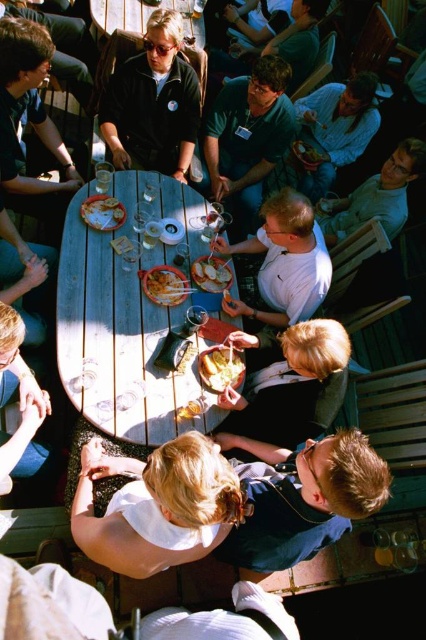
Question: Observing the image, what is the correct spatial positioning of blue denim shirt at lower right in reference to matte black shirt at left?

Choices:
 (A) below
 (B) above

Answer: (A)

Question: Which point is closer to the camera?

Choices:
 (A) white matte shirt at lower center
 (B) white matte shirt at center

Answer: (A)

Question: Which object appears farthest from the camera in this image?

Choices:
 (A) green matte shirt at upper center
 (B) smooth white plate at center

Answer: (A)

Question: Does white matte shirt at lower center come behind green cotton shirt at upper center?

Choices:
 (A) no
 (B) yes

Answer: (A)

Question: Is smooth white plate at center further to the viewer compared to golden crispy chicken at center?

Choices:
 (A) yes
 (B) no

Answer: (B)

Question: Which point is closer to the camera?

Choices:
 (A) matte plastic bowl at center
 (B) white matte shirt at upper right

Answer: (A)